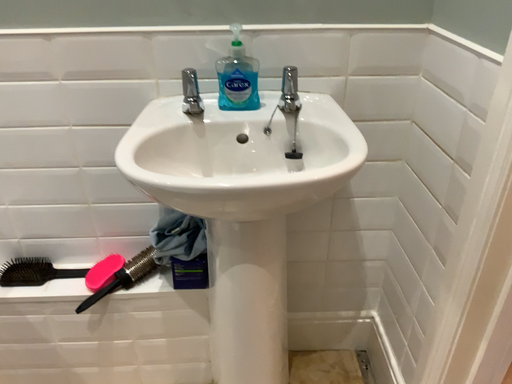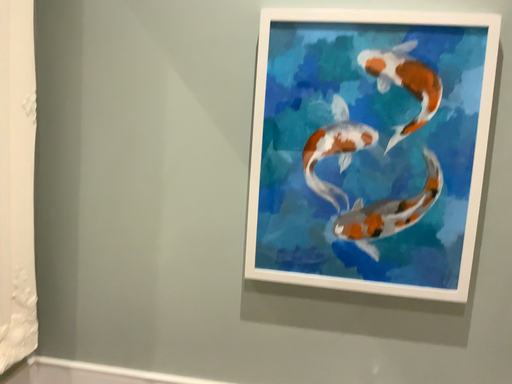
Question: Which way did the camera rotate in the video?

Choices:
 (A) rotated right
 (B) rotated left

Answer: (B)